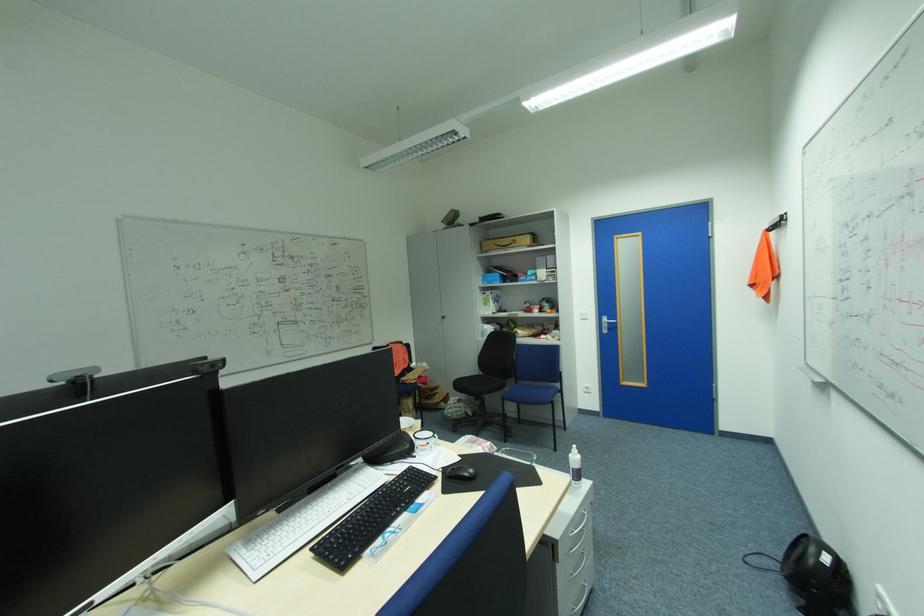
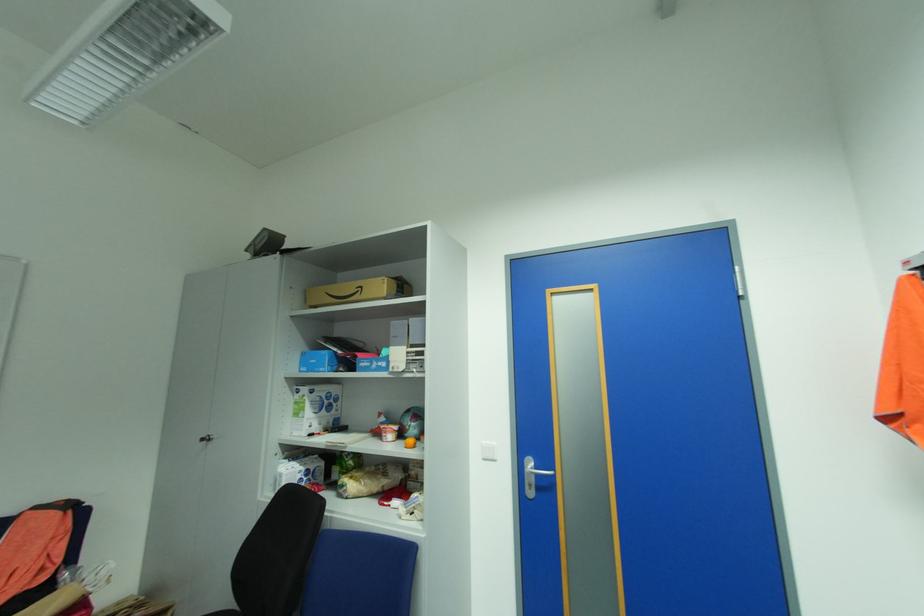
Locate, in the second image, the point that corresponds to the point at 450,317 in the first image.

(213, 439)